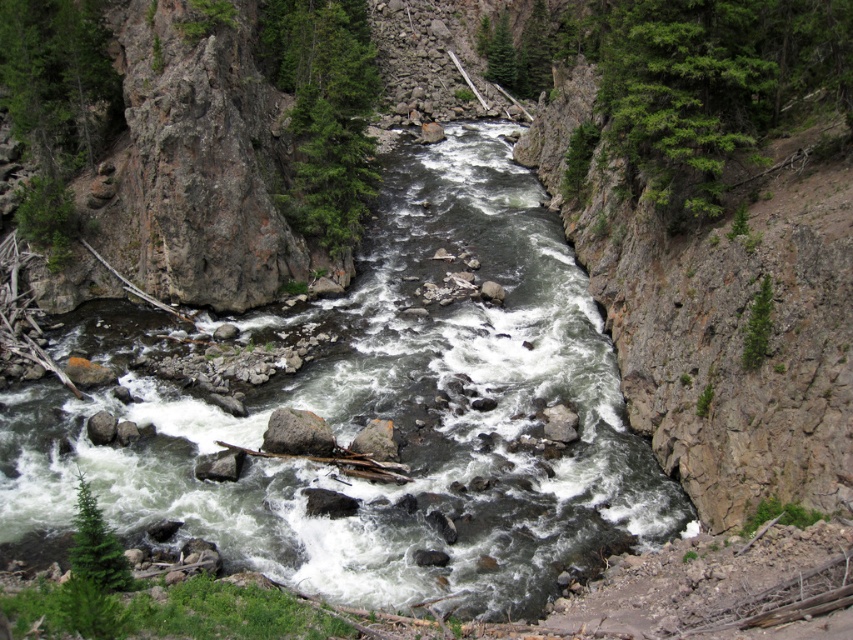
Question: Does green textured tree at upper center appear on the right side of gray rock at lower left?

Choices:
 (A) no
 (B) yes

Answer: (B)

Question: Which of the following is the farthest from the observer?

Choices:
 (A) green matte tree at lower left
 (B) green textured tree at upper center
 (C) green textured tree at upper right
 (D) gray rough rock at center

Answer: (B)

Question: Which of the following is the closest to the observer?

Choices:
 (A) green textured tree at upper right
 (B) gray rough rock at center
 (C) gray rock at lower left

Answer: (A)

Question: Estimate the real-world distances between objects in this image. Which object is farther from the green textured tree at upper center?

Choices:
 (A) gray rough rock at center
 (B) green rock stream at center

Answer: (A)

Question: Where is green textured tree at upper right located in relation to gray rough rock at center in the image?

Choices:
 (A) left
 (B) right

Answer: (B)

Question: From the image, what is the correct spatial relationship of green rock stream at center in relation to green rough bark tree at upper left?

Choices:
 (A) left
 (B) right

Answer: (B)